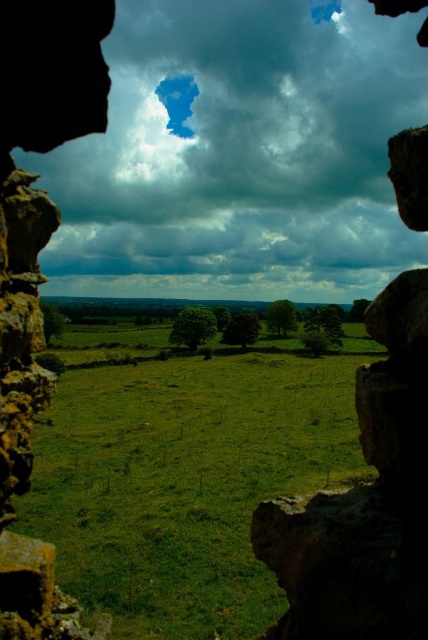
You are standing in a rural landscape with a stone frame in front of you. You notice a point at coordinates (240, 154). What does this point represent?

The point at coordinates (240, 154) represents the cloudy sky at center.

You are standing in front of an old stone ruin frame. You notice the cloudy sky at center and the green grass at center. Which object is taller?

The cloudy sky at center is taller than the green grass at center.

Looking at this image, you are an artist planning to paint the scene through the weathered stone frame. You want to ensure the cloudy sky at center and green grass at center are proportionally accurate. Which object should you paint larger?

The cloudy sky at center should be painted larger because it is bigger than the green grass at center according to the description.